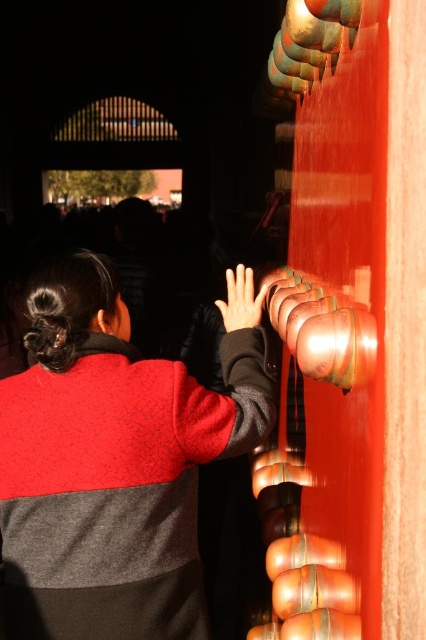
You are an artist trying to sketch the scene. You notice the speckled wool sweater at center and the matte black hand at center. Which object should you draw first if you want to follow the rule of drawing background elements before foreground elements?

The speckled wool sweater at center should be drawn first because it is much taller than the matte black hand at center, indicating it is in the background.

You are standing in front of the bells and notice two points marked on the wall. The first point is at coordinate (32, 557) and the second is at (247, 310). Which point is nearer to your eyes?

Point (32, 557) is closer to the camera than point (247, 310).

You are observing a person interacting with bells mounted on a red wall. You notice the speckled wool sweater at center and the matte black hand at center. Which object is positioned closer to you?

The speckled wool sweater at center is closer to the viewer than the matte black hand at center.